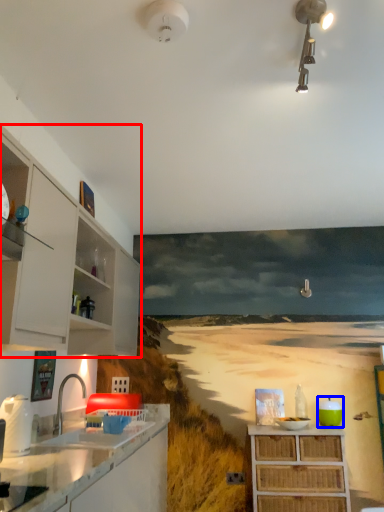
Question: Which object is closer to the camera taking this photo, cabinetry (highlighted by a red box) or appliance (highlighted by a blue box)?

Choices:
 (A) cabinetry
 (B) appliance

Answer: (A)